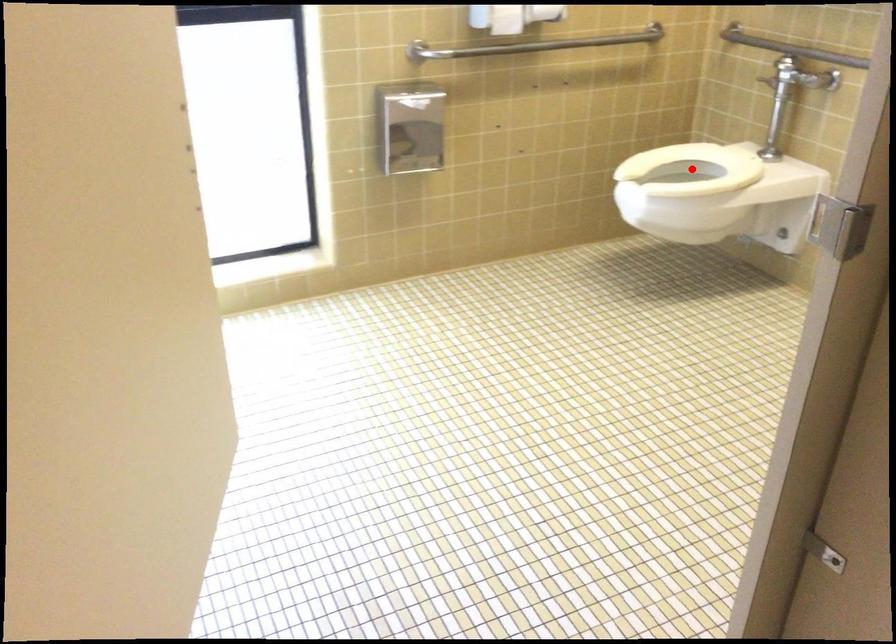
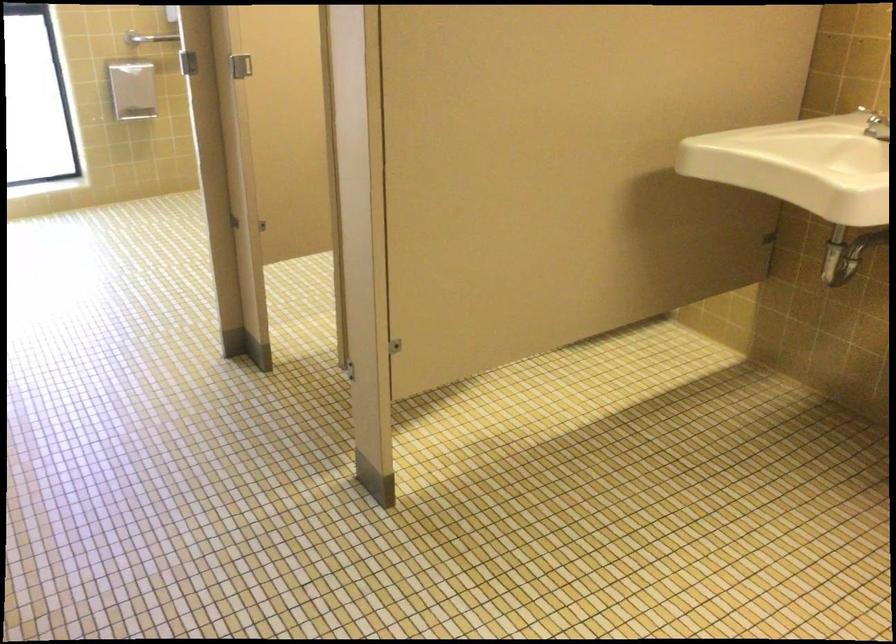
Question: I am providing you with two images of the same scene from different viewpoints. A red point is marked on the first image. Can you still see the location of the red point in image 2?

Choices:
 (A) Yes
 (B) No

Answer: (B)